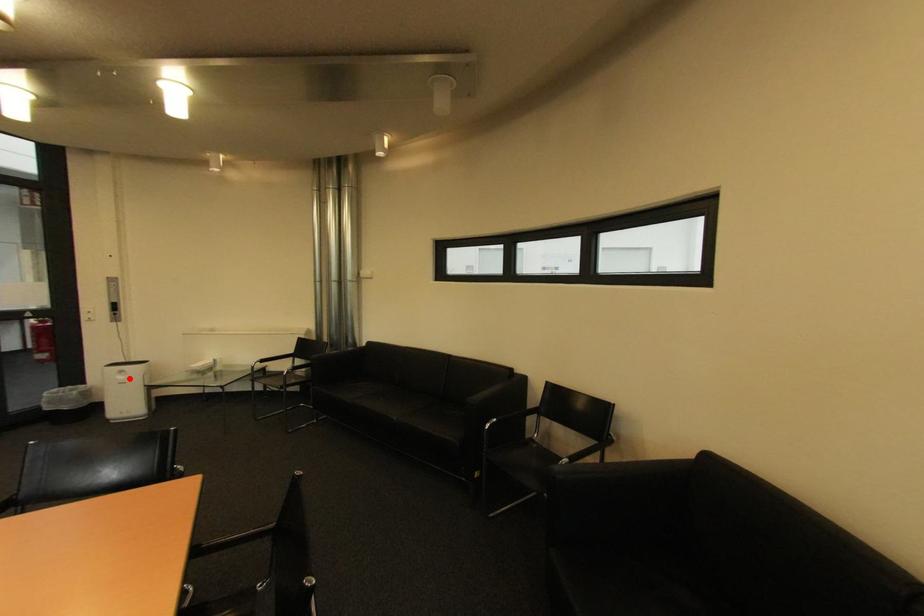
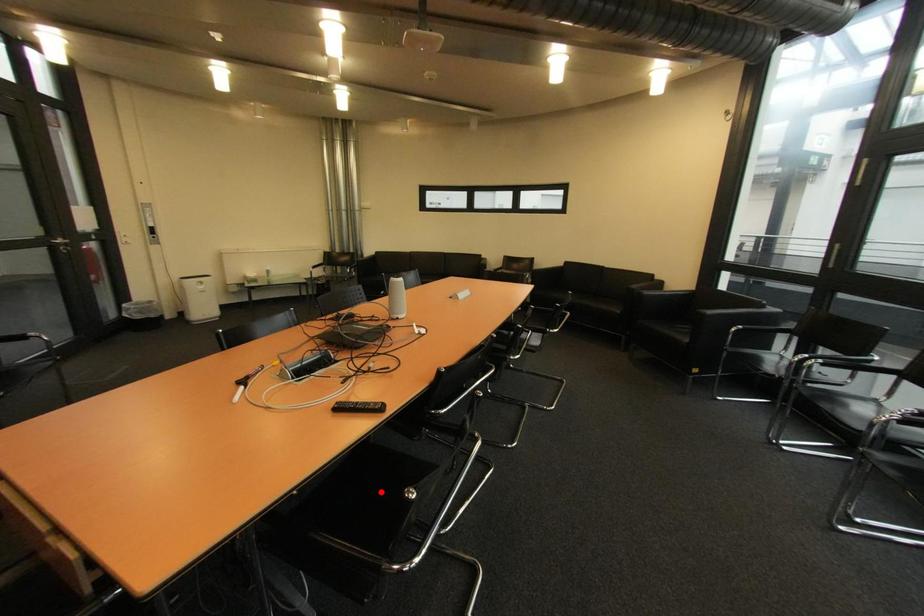
Looking at this image, I am providing you with two images of the same scene from different viewpoints. A red point is marked on the first image and another point is marked on the second image. Is the red point in image1 aligned with the point shown in image2?

No